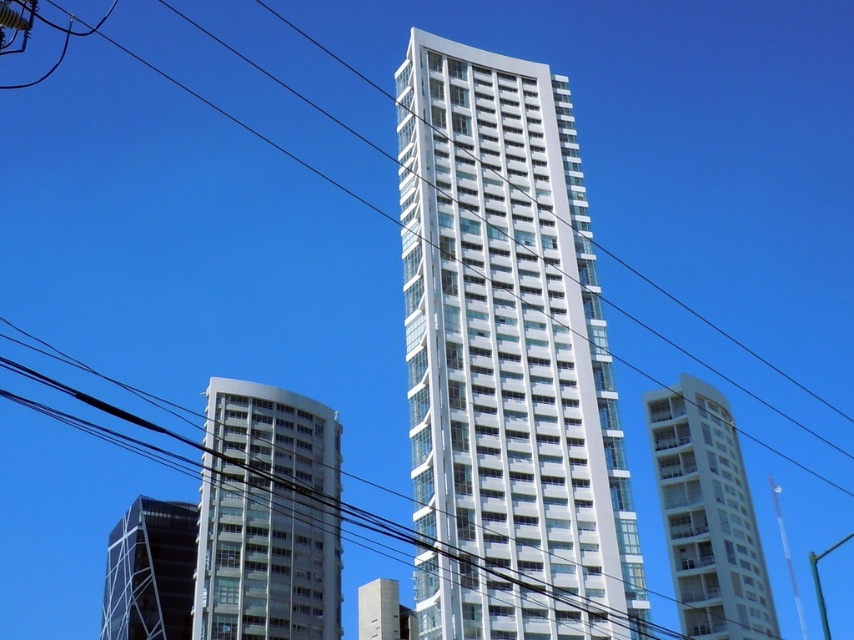
You are a city planner assessing building widths for a new project. You observe the white glass building at right and the black glass building at lower left in the scene. Which building has a narrower width according to the description?

The white glass building at right has a narrower width than the black glass building at lower left.

In the scene shown: You are a city planner evaluating the skyline. Given the white glass building at right and the black glass building at lower left, which one would cast a longer shadow at noon on a sunny day?

The white glass building at right is taller than the black glass building at lower left, so it would cast a longer shadow at noon on a sunny day because taller objects generally cast longer shadows under the same lighting conditions.